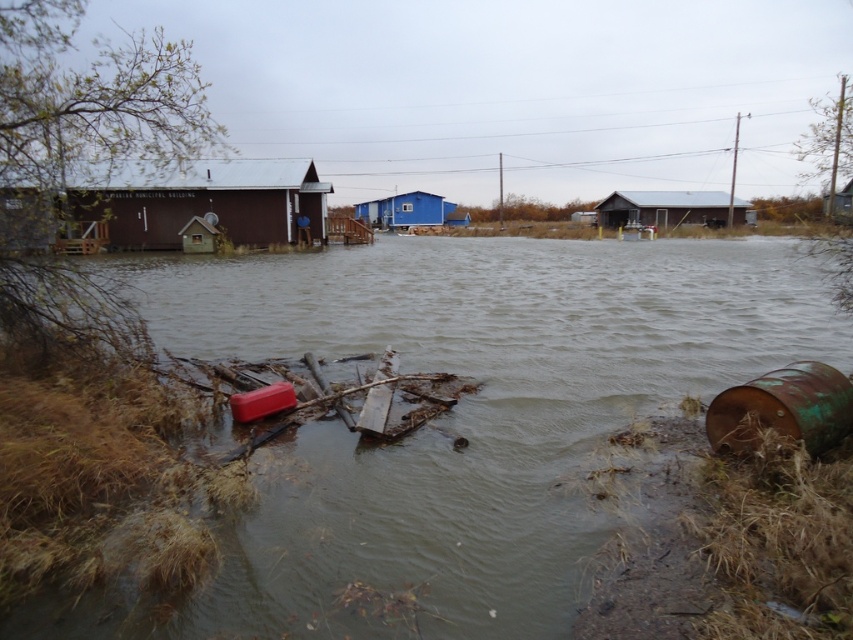
Question: Which of the following is the closest to the observer?

Choices:
 (A) brown muddy water at center
 (B) brown wooden hut at left
 (C) brown corrugated metal hut at center
 (D) rusty metallic barrel at lower right

Answer: (A)

Question: Does brown muddy water at center have a greater width compared to brown corrugated metal hut at center?

Choices:
 (A) no
 (B) yes

Answer: (A)

Question: Considering the real-world distances, which object is closest to the blue wooden hut at center?

Choices:
 (A) brown corrugated metal hut at center
 (B) brown muddy water at center
 (C) rusty metallic barrel at lower right

Answer: (A)

Question: Does brown muddy water at center appear on the left side of blue wooden hut at center?

Choices:
 (A) yes
 (B) no

Answer: (B)

Question: Which of these objects is positioned closest to the brown muddy water at center?

Choices:
 (A) brown corrugated metal hut at center
 (B) blue wooden hut at center
 (C) rusty metallic barrel at lower right

Answer: (C)

Question: Can you confirm if brown muddy water at center is thinner than brown corrugated metal hut at center?

Choices:
 (A) yes
 (B) no

Answer: (A)